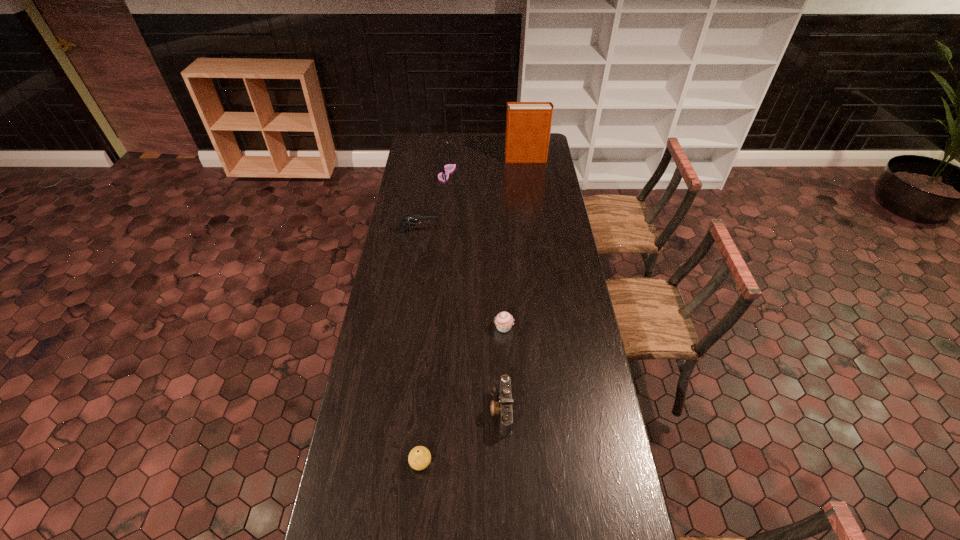
Image resolution: width=960 pixels, height=540 pixels. Identify the location of the tallest object. (528, 124).

What are the coordinates of `the rightmost object` in the screenshot? It's located at (528, 124).

The height and width of the screenshot is (540, 960). In order to click on the fifth nearest object in this screenshot , I will do `click(449, 168)`.

This screenshot has width=960, height=540. I want to click on the second tallest object, so click(449, 168).

Where is `gun`? The width and height of the screenshot is (960, 540). gun is located at coordinates (412, 219).

At what (x,y) coordinates should I click in order to perform the action: click on pear. Please return your answer as a coordinate pair (x, y). Looking at the image, I should click on (419, 458).

Find the location of a particular element. Image resolution: width=960 pixels, height=540 pixels. the fifth farthest object is located at coordinates (503, 408).

Identify the location of the third nearest object. This screenshot has width=960, height=540. (504, 321).

In order to click on vacant space located 0.300m on the open cover of the rightmost object in this screenshot , I will do `click(452, 159)`.

The width and height of the screenshot is (960, 540). I want to click on vacant space located on the open cover of the rightmost object, so click(458, 159).